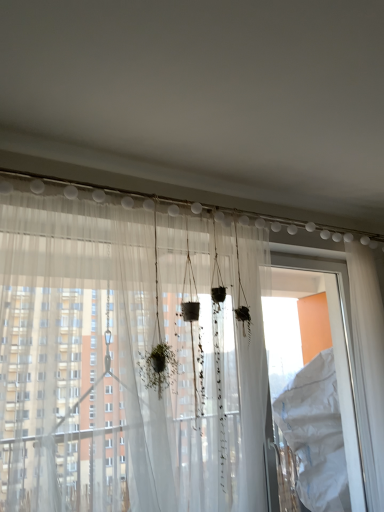
Question: Is translucent fabric at center thinner than white plastic screen door at right?

Choices:
 (A) yes
 (B) no

Answer: (B)

Question: Is translucent fabric at center to the left of white plastic screen door at right from the viewer's perspective?

Choices:
 (A) yes
 (B) no

Answer: (A)

Question: Is translucent fabric at center far away from white plastic screen door at right?

Choices:
 (A) no
 (B) yes

Answer: (B)

Question: From a real-world perspective, is translucent fabric at center located higher than white plastic screen door at right?

Choices:
 (A) yes
 (B) no

Answer: (A)

Question: Does translucent fabric at center have a greater width compared to white plastic screen door at right?

Choices:
 (A) no
 (B) yes

Answer: (B)

Question: Is white plastic screen door at right inside translucent fabric at center?

Choices:
 (A) no
 (B) yes

Answer: (A)

Question: Is translucent fabric at center far from translucent fabric curtain at center?

Choices:
 (A) no
 (B) yes

Answer: (A)

Question: From the image's perspective, is translucent fabric at center over translucent fabric curtain at center?

Choices:
 (A) yes
 (B) no

Answer: (A)

Question: Is translucent fabric at center to the left of translucent fabric curtain at center from the viewer's perspective?

Choices:
 (A) no
 (B) yes

Answer: (B)

Question: Considering the relative sizes of translucent fabric at center and translucent fabric curtain at center in the image provided, is translucent fabric at center shorter than translucent fabric curtain at center?

Choices:
 (A) no
 (B) yes

Answer: (B)

Question: Is translucent fabric curtain at center located within translucent fabric at center?

Choices:
 (A) yes
 (B) no

Answer: (B)

Question: Does translucent fabric at center appear on the right side of translucent fabric curtain at center?

Choices:
 (A) yes
 (B) no

Answer: (B)

Question: Would you say translucent fabric curtain at center is outside translucent fabric at center?

Choices:
 (A) yes
 (B) no

Answer: (A)